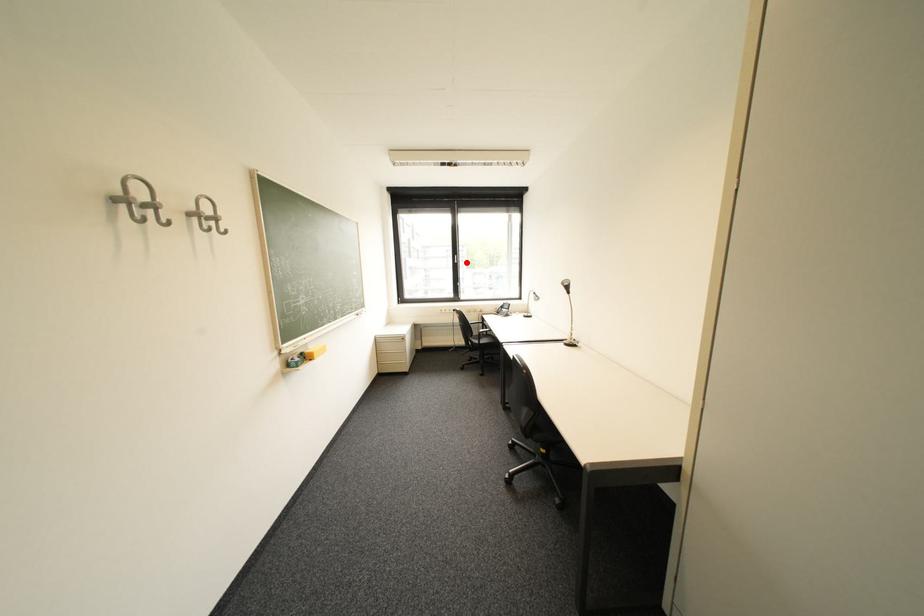
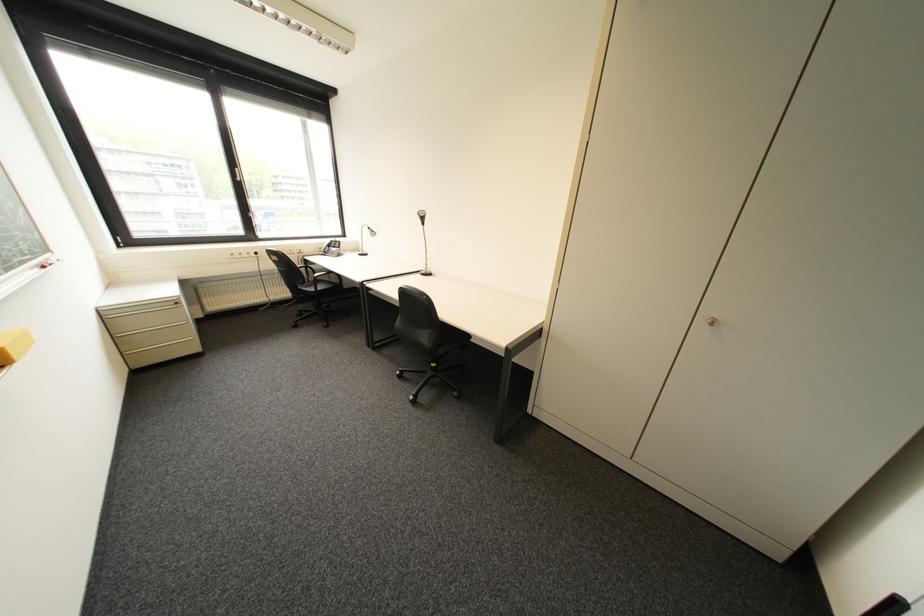
Locate, in the second image, the point that corresponds to the highlighted location in the first image.

(249, 180)